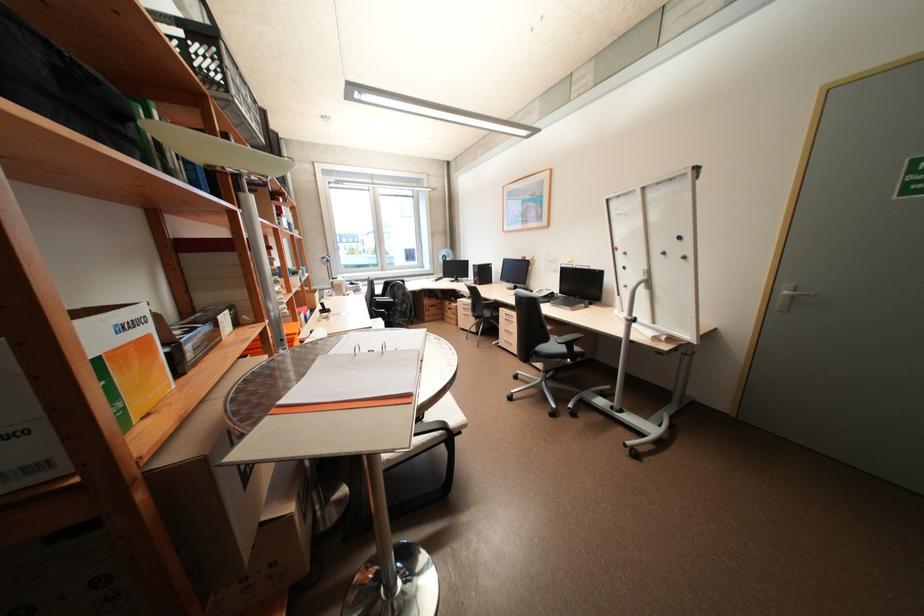
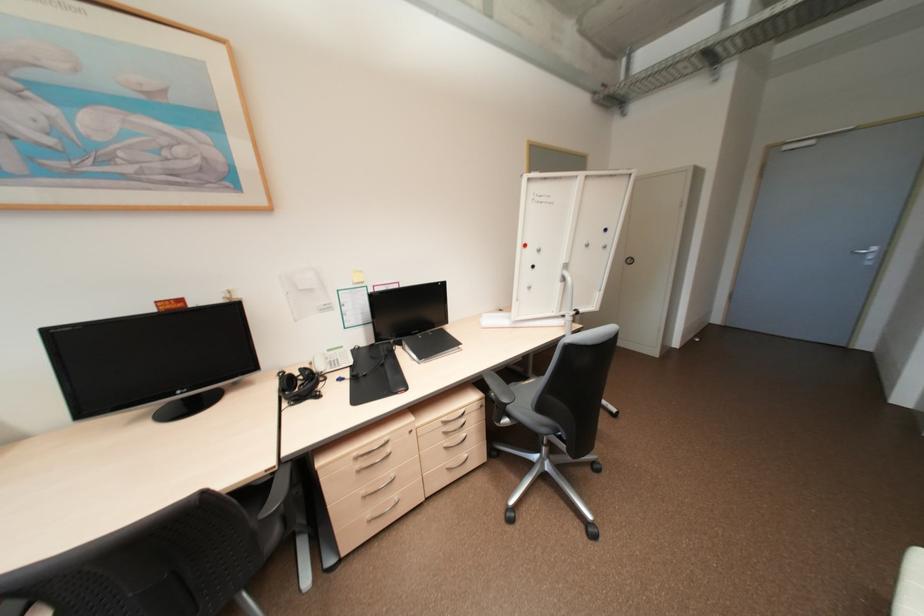
Where in the second image is the point corresponding to [622,248] from the first image?

(530, 245)